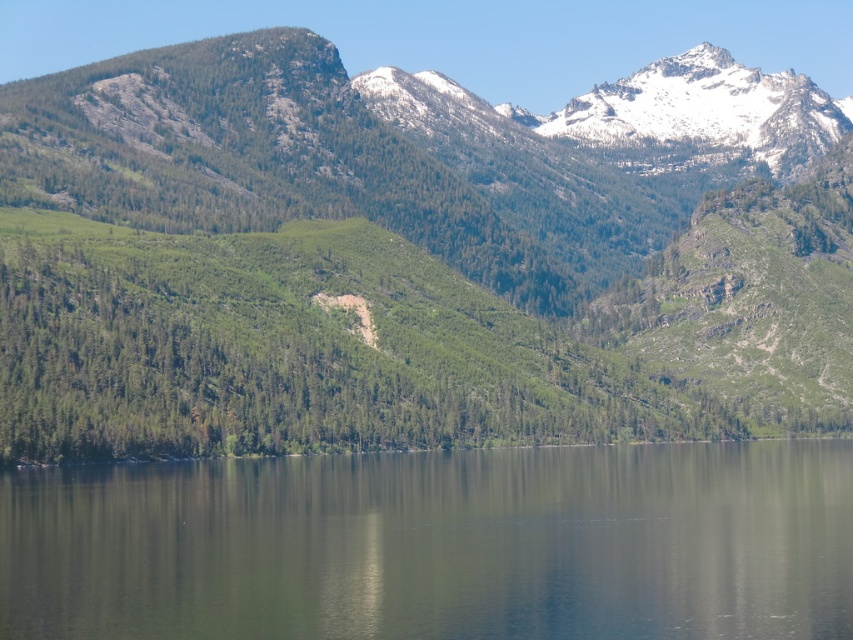
You are standing at the point labeled point (x=415, y=257) in the image. What type of terrain are you currently standing on?

The point (x=415, y=257) is on green forested mountain at center, so you are standing on a green forested mountain.

From the picture: You are standing at the edge of the green reflective water at center and want to hike up to the green forested mountain at center. Based on the scene, which direction should you head to reach the mountain?

The green forested mountain at center is located above the green reflective water at center, so you should head upwards from the water to reach the mountain.

You are standing at the edge of the green reflective water at center and want to reach the green forested mountain at center. Which direction should you move to get closer to the mountain?

Since the green forested mountain at center is further to the viewer than the green reflective water at center, you are already closer to the mountain. To reach it, you should move forward away from the water towards the direction it appears in the scene.